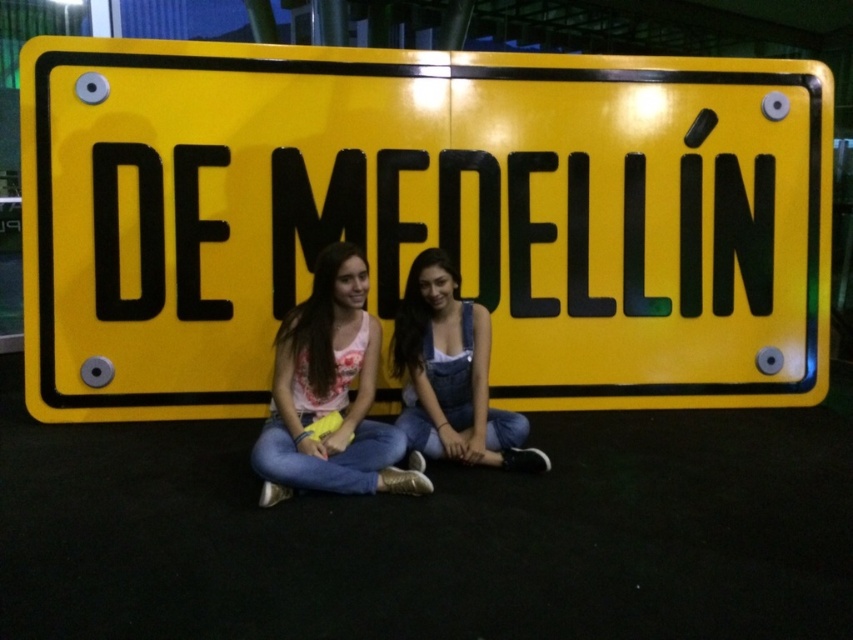
You are a photographer trying to capture a photo of the matte pink shirt at center and denim overalls at center. Since you want to focus on both subjects equally, which subject should you adjust your camera angle to prioritize in terms of height?

The matte pink shirt at center has a greater height compared to denim overalls at center, so you should adjust your camera angle to prioritize the matte pink shirt at center to ensure both subjects are captured proportionally.